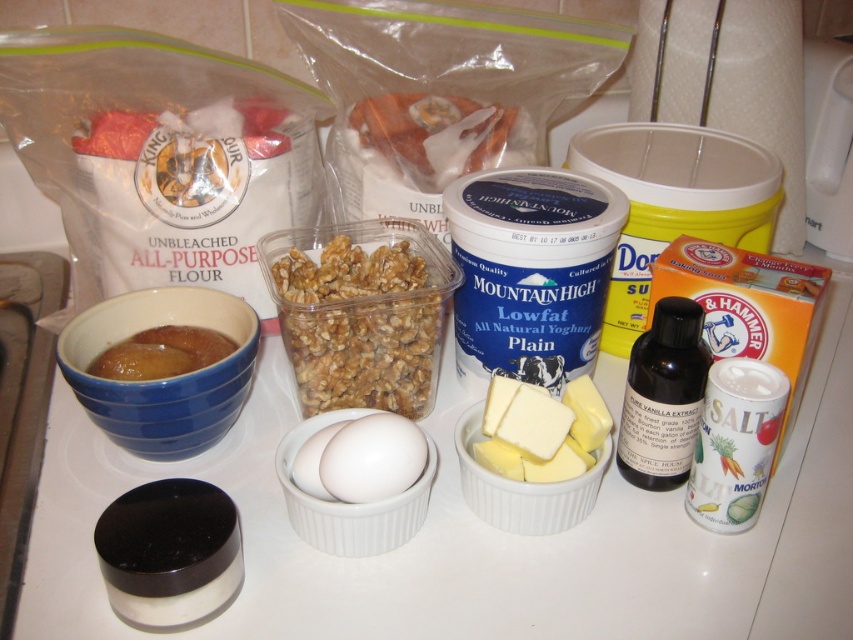
You are a baker preparing a recipe that requires precise measurements. You need to place the blue matte container at center and the brown glossy jam at left exactly 10 inches apart. Based on the current arrangement, can you achieve the required distance?

The blue matte container at center and brown glossy jam at left are currently 9.75 inches apart, which is 0.25 inches less than the required 10 inches. To meet the requirement, you would need to move them slightly farther apart by 0.25 inches.

You are preparing to bake and need to fit both the blue matte container at center and the clear plastic container of walnuts at center into a drawer that is 20 cm wide. Based on their sizes, can both containers fit side by side?

The blue matte container at center has a width less than the clear plastic container of walnuts at center. If the combined width of both containers is less than 20 cm, they can fit. However, since we only know the relative sizes, not exact measurements, it is uncertain without knowing the exact widths.

You are preparing to bake a cake and need to place the yellow creamy butter at center and the brown glossy jam at left into the oven. The oven has a height limit of 12 inches. Can both items fit vertically without exceeding the oven height?

The yellow creamy butter at center is much taller than the brown glossy jam at left. Since the oven has a height limit of 12 inches, we need to know the exact height of the butter. However, the description only states it is taller than the jam, but does not provide specific measurements. Therefore, it is uncertain if both items will fit without exceeding the oven height.